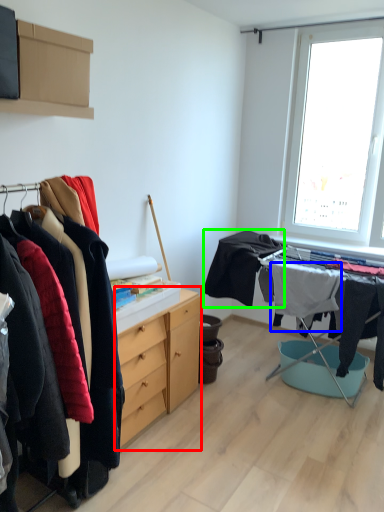
Question: Estimate the real-world distances between objects in this image. Which object is farther from chest of drawers (highlighted by a red box), clothing (highlighted by a blue box) or clothing (highlighted by a green box)?

Choices:
 (A) clothing
 (B) clothing

Answer: (A)